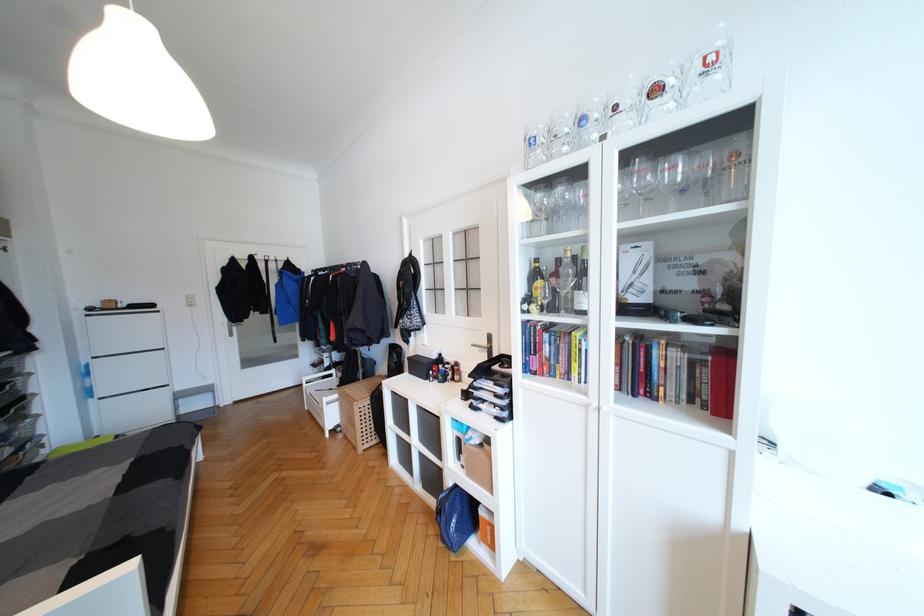
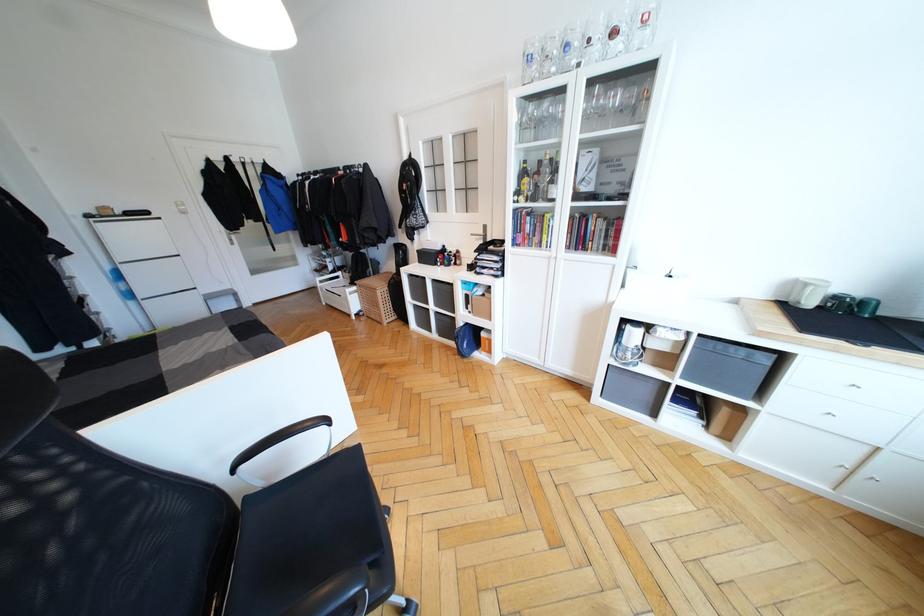
The images are taken continuously from a first-person perspective. In which direction are you moving?

The cameraman walked toward left, backward.